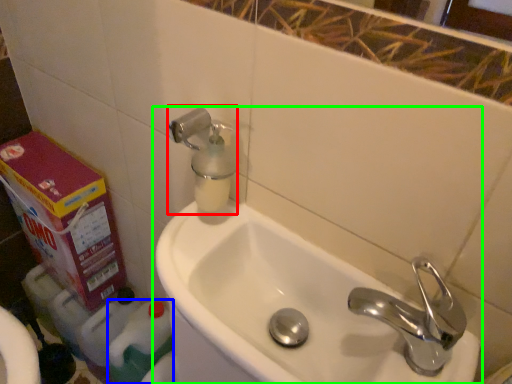
Question: Considering the real-world distances, which object is closest to soap dispenser (highlighted by a red box)? cleaning product (highlighted by a blue box) or sink (highlighted by a green box).

Choices:
 (A) cleaning product
 (B) sink

Answer: (B)